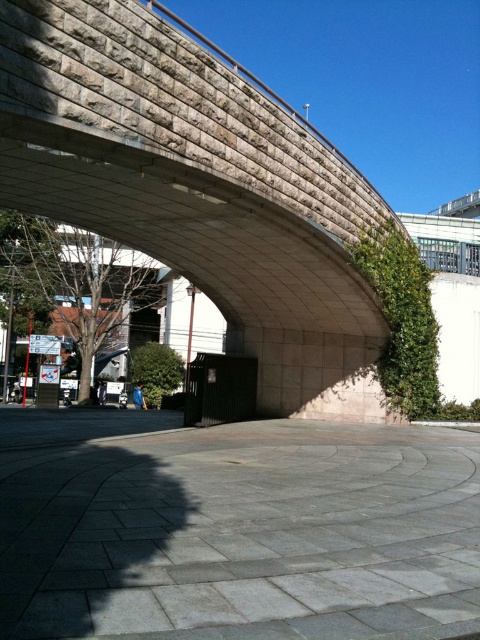
Does gray concrete pavement at center appear under stone textured bridge at center?

Yes.

Between gray concrete pavement at center and stone textured bridge at center, which one has more height?

stone textured bridge at center

Describe the element at coordinates (235, 529) in the screenshot. I see `gray concrete pavement at center` at that location.

Image resolution: width=480 pixels, height=640 pixels. I want to click on gray concrete pavement at center, so click(235, 529).